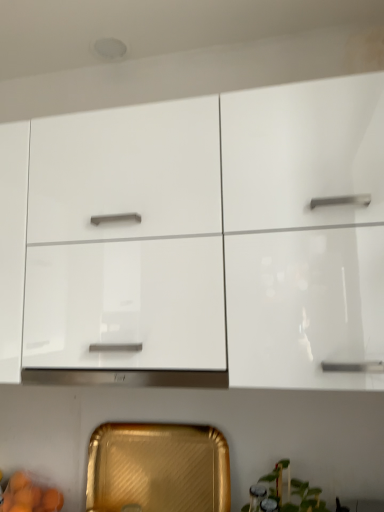
This screenshot has width=384, height=512. Describe the element at coordinates (158, 468) in the screenshot. I see `gold textured tray at lower center, marked as the second cabinetry in a top-to-bottom arrangement` at that location.

Where is `green glossy plant at lower right`? Image resolution: width=384 pixels, height=512 pixels. green glossy plant at lower right is located at coordinates (287, 493).

How different are the orientations of green glossy plant at lower right and white glossy cabinet at upper center, which ranks as the 1th cabinetry in top-to-bottom order, in degrees?

The angular difference between green glossy plant at lower right and white glossy cabinet at upper center, which ranks as the 1th cabinetry in top-to-bottom order, is 1.1 degrees.

Is green glossy plant at lower right further to the viewer compared to white glossy cabinet at upper center, placed as the 2th cabinetry when sorted from bottom to top?

Yes, it is.

Is green glossy plant at lower right looking in the opposite direction of white glossy cabinet at upper center, which ranks as the 1th cabinetry in top-to-bottom order?

No.

Does point (304, 508) come farther from viewer compared to point (287, 377)?

That is True.

From a real-world perspective, is green glossy plant at lower right on gold textured tray at lower center, marked as the second cabinetry in a top-to-bottom arrangement?

No, from a real-world perspective, green glossy plant at lower right is not on top of gold textured tray at lower center, marked as the second cabinetry in a top-to-bottom arrangement.

Between green glossy plant at lower right and gold textured tray at lower center, which is the first cabinetry in bottom-to-top order, which one has smaller size?

With smaller size is green glossy plant at lower right.

Is green glossy plant at lower right far from gold textured tray at lower center, marked as the second cabinetry in a top-to-bottom arrangement?

No, green glossy plant at lower right is not far away from gold textured tray at lower center, marked as the second cabinetry in a top-to-bottom arrangement.

This screenshot has width=384, height=512. Identify the location of cabinetry that is behind the white glossy cabinet at upper center, placed as the 2th cabinetry when sorted from bottom to top. (158, 468).

Are gold textured tray at lower center, which is the first cabinetry in bottom-to-top order, and white glossy cabinet at upper center, placed as the 2th cabinetry when sorted from bottom to top, far apart?

gold textured tray at lower center, which is the first cabinetry in bottom-to-top order, is near white glossy cabinet at upper center, placed as the 2th cabinetry when sorted from bottom to top, not far away.

Would you say gold textured tray at lower center, which is the first cabinetry in bottom-to-top order, is inside or outside white glossy cabinet at upper center, which ranks as the 1th cabinetry in top-to-bottom order?

gold textured tray at lower center, which is the first cabinetry in bottom-to-top order, is outside white glossy cabinet at upper center, which ranks as the 1th cabinetry in top-to-bottom order.

Is gold textured tray at lower center, which is the first cabinetry in bottom-to-top order, facing away from white glossy cabinet at upper center, placed as the 2th cabinetry when sorted from bottom to top?

gold textured tray at lower center, which is the first cabinetry in bottom-to-top order, does not have its back to white glossy cabinet at upper center, placed as the 2th cabinetry when sorted from bottom to top.

Can you confirm if gold textured tray at lower center, which is the first cabinetry in bottom-to-top order, is thinner than green glossy plant at lower right?

Indeed, gold textured tray at lower center, which is the first cabinetry in bottom-to-top order, has a lesser width compared to green glossy plant at lower right.

Considering the relative positions of gold textured tray at lower center, marked as the second cabinetry in a top-to-bottom arrangement, and green glossy plant at lower right in the image provided, is gold textured tray at lower center, marked as the second cabinetry in a top-to-bottom arrangement, in front of green glossy plant at lower right?

No, the depth of gold textured tray at lower center, marked as the second cabinetry in a top-to-bottom arrangement, is greater than that of green glossy plant at lower right.

From a real-world perspective, is gold textured tray at lower center, marked as the second cabinetry in a top-to-bottom arrangement, positioned under green glossy plant at lower right based on gravity?

No, from a real-world perspective, gold textured tray at lower center, marked as the second cabinetry in a top-to-bottom arrangement, is not beneath green glossy plant at lower right.

Locate an element on the screen. The width and height of the screenshot is (384, 512). cabinetry above the gold textured tray at lower center, which is the first cabinetry in bottom-to-top order (from the image's perspective) is located at coordinates (199, 237).

Which is closer to the camera, (297, 292) or (87, 483)?

Point (297, 292) is closer to the camera than point (87, 483).

Would you say white glossy cabinet at upper center, placed as the 2th cabinetry when sorted from bottom to top, is outside gold textured tray at lower center, marked as the second cabinetry in a top-to-bottom arrangement?

Yes, white glossy cabinet at upper center, placed as the 2th cabinetry when sorted from bottom to top, is not within gold textured tray at lower center, marked as the second cabinetry in a top-to-bottom arrangement.

Locate an element on the screen. plant on the right of white glossy cabinet at upper center, which ranks as the 1th cabinetry in top-to-bottom order is located at coordinates (287, 493).

From the image's perspective, is white glossy cabinet at upper center, placed as the 2th cabinetry when sorted from bottom to top, above or below green glossy plant at lower right?

From the image's perspective, white glossy cabinet at upper center, placed as the 2th cabinetry when sorted from bottom to top, appears above green glossy plant at lower right.

In terms of height, does white glossy cabinet at upper center, placed as the 2th cabinetry when sorted from bottom to top, look taller or shorter compared to green glossy plant at lower right?

white glossy cabinet at upper center, placed as the 2th cabinetry when sorted from bottom to top, is taller than green glossy plant at lower right.

Looking at their sizes, would you say white glossy cabinet at upper center, which ranks as the 1th cabinetry in top-to-bottom order, is wider or thinner than green glossy plant at lower right?

white glossy cabinet at upper center, which ranks as the 1th cabinetry in top-to-bottom order, is wider than green glossy plant at lower right.

The height and width of the screenshot is (512, 384). I want to click on cabinetry in front of the green glossy plant at lower right, so click(x=199, y=237).

Identify the location of plant that is on the right side of gold textured tray at lower center, which is the first cabinetry in bottom-to-top order. (287, 493).

Estimate the real-world distances between objects in this image. Which object is further from green glossy plant at lower right, gold textured tray at lower center, which is the first cabinetry in bottom-to-top order, or white glossy cabinet at upper center, placed as the 2th cabinetry when sorted from bottom to top?

white glossy cabinet at upper center, placed as the 2th cabinetry when sorted from bottom to top, is further to green glossy plant at lower right.

When comparing their distances from gold textured tray at lower center, which is the first cabinetry in bottom-to-top order, does green glossy plant at lower right or white glossy cabinet at upper center, placed as the 2th cabinetry when sorted from bottom to top, seem further?

white glossy cabinet at upper center, placed as the 2th cabinetry when sorted from bottom to top, lies further to gold textured tray at lower center, which is the first cabinetry in bottom-to-top order, than the other object.

Based on their spatial positions, is white glossy cabinet at upper center, placed as the 2th cabinetry when sorted from bottom to top, or gold textured tray at lower center, marked as the second cabinetry in a top-to-bottom arrangement, closer to green glossy plant at lower right?

gold textured tray at lower center, marked as the second cabinetry in a top-to-bottom arrangement, lies closer to green glossy plant at lower right than the other object.

Considering their positions, is gold textured tray at lower center, which is the first cabinetry in bottom-to-top order, positioned closer to white glossy cabinet at upper center, which ranks as the 1th cabinetry in top-to-bottom order, than green glossy plant at lower right?

Based on the image, gold textured tray at lower center, which is the first cabinetry in bottom-to-top order, appears to be nearer to white glossy cabinet at upper center, which ranks as the 1th cabinetry in top-to-bottom order.

Looking at the image, which one is located further to gold textured tray at lower center, which is the first cabinetry in bottom-to-top order, white glossy cabinet at upper center, placed as the 2th cabinetry when sorted from bottom to top, or green glossy plant at lower right?

The object further to gold textured tray at lower center, which is the first cabinetry in bottom-to-top order, is white glossy cabinet at upper center, placed as the 2th cabinetry when sorted from bottom to top.

Looking at the image, which one is located further to white glossy cabinet at upper center, which ranks as the 1th cabinetry in top-to-bottom order, green glossy plant at lower right or gold textured tray at lower center, which is the first cabinetry in bottom-to-top order?

green glossy plant at lower right.

Find the location of `cabinetry between white glossy cabinet at upper center, which ranks as the 1th cabinetry in top-to-bottom order, and green glossy plant at lower right from top to bottom`. cabinetry between white glossy cabinet at upper center, which ranks as the 1th cabinetry in top-to-bottom order, and green glossy plant at lower right from top to bottom is located at coordinates (158, 468).